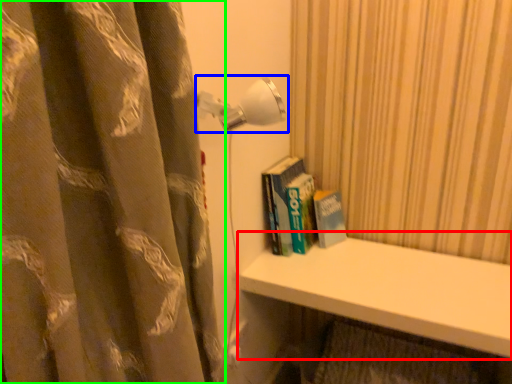
Question: Based on their relative distances, which object is farther from window sill (highlighted by a red box)? Choose from lamp (highlighted by a blue box) and curtain (highlighted by a green box).

Choices:
 (A) lamp
 (B) curtain

Answer: (B)